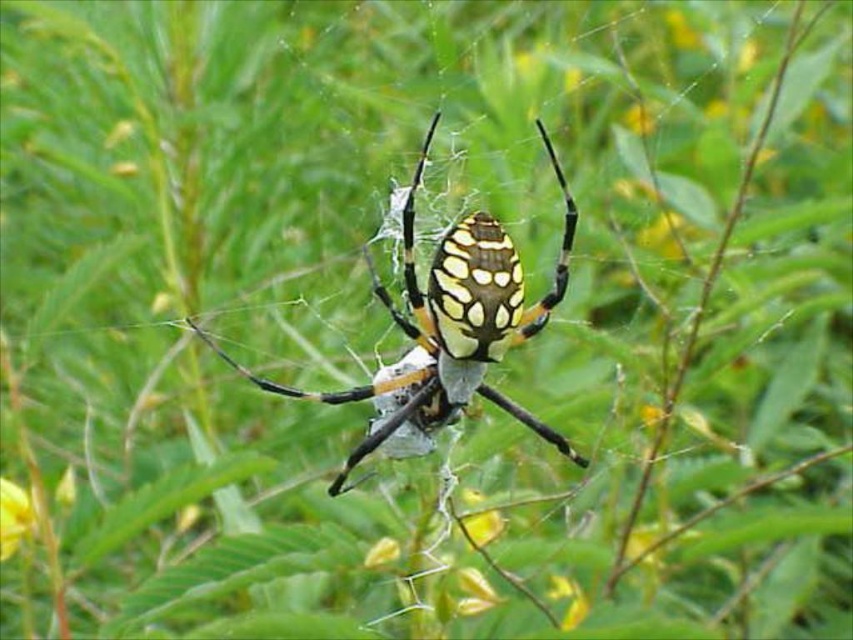
Question: Is yellow and black striped spider at center to the right of yellow matte flower at lower left from the viewer's perspective?

Choices:
 (A) yes
 (B) no

Answer: (A)

Question: Does yellow and black striped spider at center have a lesser width compared to yellow matte flower at lower left?

Choices:
 (A) yes
 (B) no

Answer: (B)

Question: Where is yellow and black striped spider at center located in relation to yellow matte flower at lower left in the image?

Choices:
 (A) right
 (B) left

Answer: (A)

Question: Among these objects, which one is farthest from the camera?

Choices:
 (A) yellow and black striped spider at center
 (B) yellow matte flower at lower left

Answer: (A)